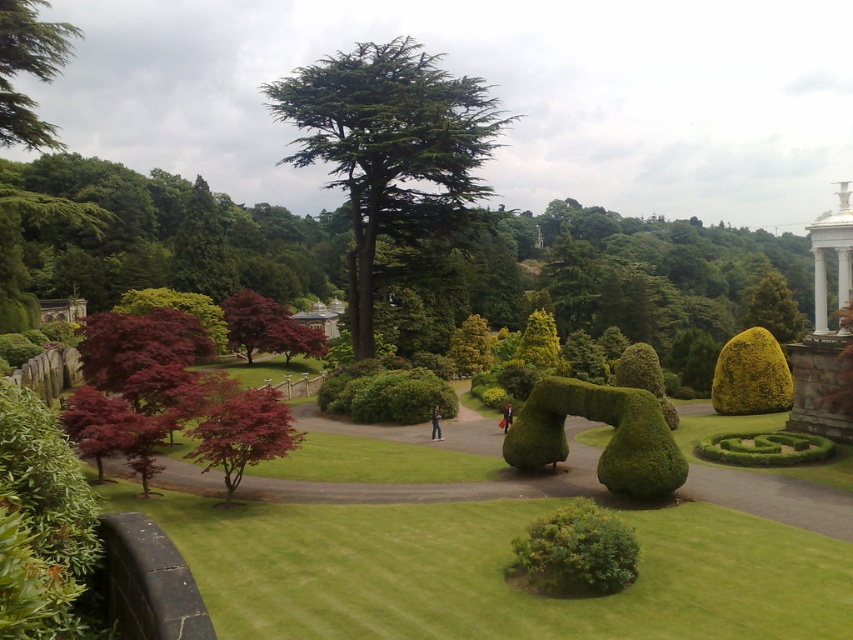
At what (x,y) coordinates should I click in order to perform the action: click on white marble gazebo at right. Please return your answer as a coordinate pair (x, y). This screenshot has width=853, height=640. Looking at the image, I should click on (824, 330).

Describe the element at coordinates (824, 330) in the screenshot. I see `white marble gazebo at right` at that location.

Is point (838, 205) positioned behind point (437, 424)?

No, (838, 205) is in front of (437, 424).

Image resolution: width=853 pixels, height=640 pixels. I want to click on white marble gazebo at right, so click(824, 330).

Consider the image. Which is above, reddish-brown bark tree at center-left or light blue jeans at center?

reddish-brown bark tree at center-left is above.

Does reddish-brown bark tree at center-left appear on the right side of light blue jeans at center?

In fact, reddish-brown bark tree at center-left is to the left of light blue jeans at center.

Who is more forward, (253, 417) or (437, 433)?

Point (253, 417) is more forward.

Find the location of `reddish-brown bark tree at center-left`. reddish-brown bark tree at center-left is located at coordinates (242, 433).

Between green leafy bush at center and green leafy bush at right, which one is positioned lower?

green leafy bush at center is lower down.

The image size is (853, 640). What do you see at coordinates (576, 552) in the screenshot?
I see `green leafy bush at center` at bounding box center [576, 552].

What do you see at coordinates (576, 552) in the screenshot? I see `green leafy bush at center` at bounding box center [576, 552].

The height and width of the screenshot is (640, 853). I want to click on green leafy bush at center, so click(576, 552).